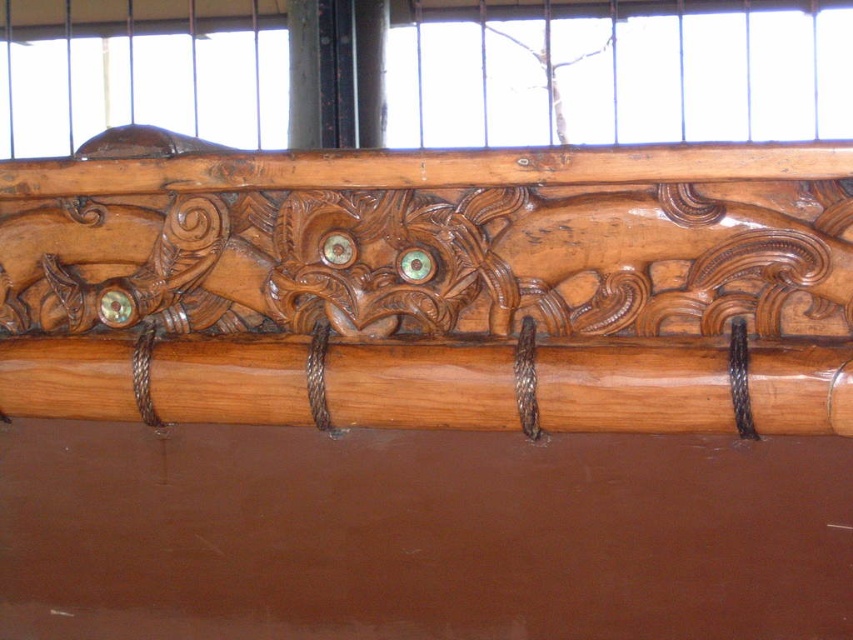
Question: Does shiny brown wood carving at center have a lesser width compared to shiny brown wood at center?

Choices:
 (A) yes
 (B) no

Answer: (B)

Question: Does shiny brown wood carving at center appear under shiny brown wood at center?

Choices:
 (A) yes
 (B) no

Answer: (B)

Question: Which point is closer to the camera?

Choices:
 (A) shiny brown wood at center
 (B) shiny brown wood carving at center

Answer: (B)

Question: Is shiny brown wood carving at center closer to camera compared to shiny brown wood at center?

Choices:
 (A) yes
 (B) no

Answer: (A)

Question: Which point appears closest to the camera in this image?

Choices:
 (A) (505, 163)
 (B) (374, 364)

Answer: (A)